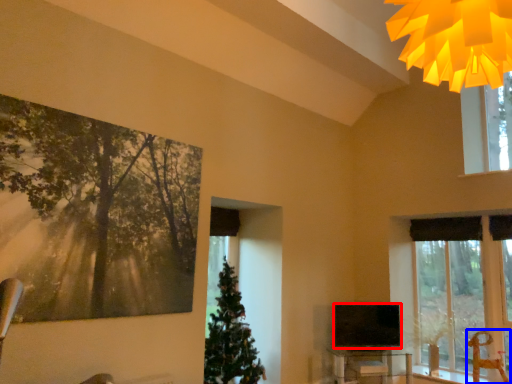
Question: Among these objects, which one is farthest to the camera, television (highlighted by a red box) or swivel chair (highlighted by a blue box)?

Choices:
 (A) television
 (B) swivel chair

Answer: (A)